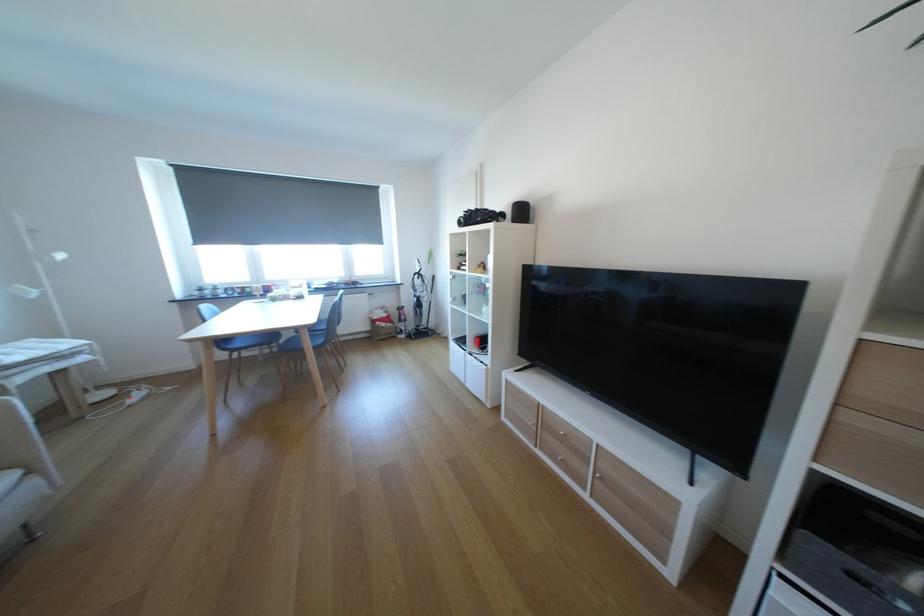
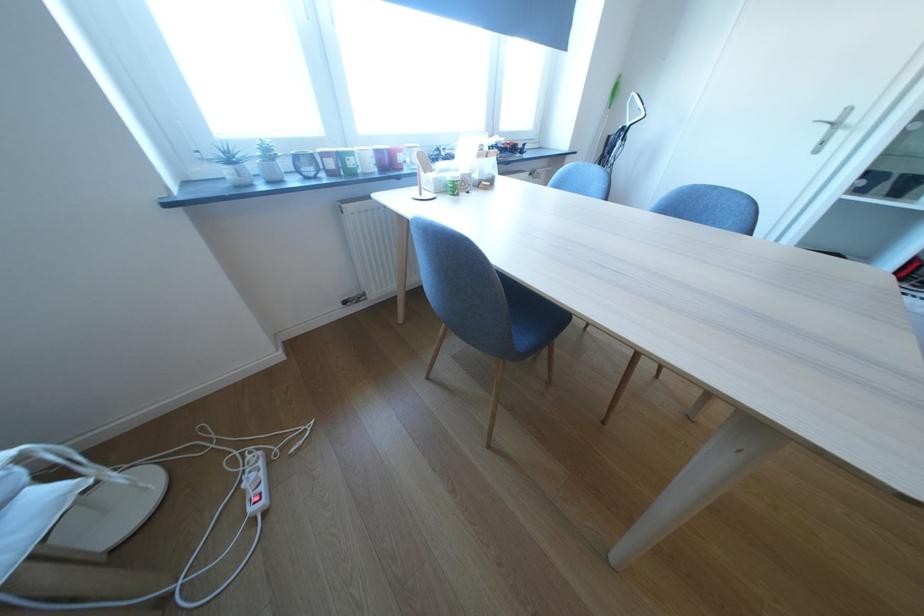
Where in the second image is the point corresponding to point (280, 286) from the first image?

(399, 151)